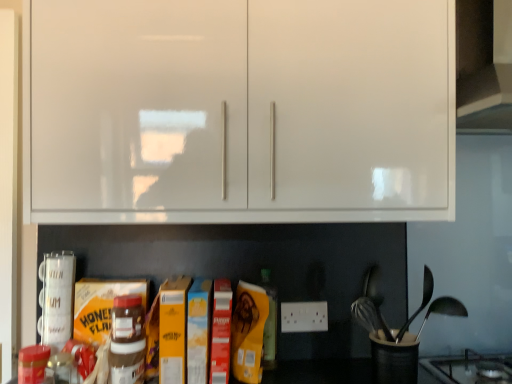
Where is `black plastic utensil holder at lower right`? The height and width of the screenshot is (384, 512). black plastic utensil holder at lower right is located at coordinates (394, 359).

The width and height of the screenshot is (512, 384). I want to click on matte brown plastic nutella jar at center, the second bottle positioned from the right, so click(127, 341).

In order to face satin silver spoon at right, should I rotate leftwards or rightwards?

Turn right approximately 21.248 degrees to face it.

The image size is (512, 384). What do you see at coordinates (421, 303) in the screenshot?
I see `satin silver spoon at right` at bounding box center [421, 303].

Measure the distance between matte brown bottle at center, which ranks as the first bottle in right-to-left order, and camera.

3.98 feet.

This screenshot has height=384, width=512. What do you see at coordinates (470, 369) in the screenshot?
I see `black glass gas stove at lower right` at bounding box center [470, 369].

I want to click on black plastic utensil holder at lower right, so coord(394,359).

From a real-world perspective, is matte brown plastic nutella jar at center, the first bottle in the front-to-back sequence, located beneath black glass gas stove at lower right?

Incorrect, from a real-world perspective, matte brown plastic nutella jar at center, the first bottle in the front-to-back sequence, is higher than black glass gas stove at lower right.

Can you tell me how much matte brown plastic nutella jar at center, marked as the second bottle in a back-to-front arrangement, and black glass gas stove at lower right differ in facing direction?

There is a 1.12-degree angle between the facing directions of matte brown plastic nutella jar at center, marked as the second bottle in a back-to-front arrangement, and black glass gas stove at lower right.

I want to click on the 2nd bottle to the left of the black glass gas stove at lower right, counting from the anchor's position, so click(127, 341).

Can you confirm if matte brown plastic nutella jar at center, the second bottle positioned from the right, is wider than black glass gas stove at lower right?

In fact, matte brown plastic nutella jar at center, the second bottle positioned from the right, might be narrower than black glass gas stove at lower right.

Can we say matte brown plastic nutella jar at center, the second bottle positioned from the right, lies outside white glossy cabinet at upper center?

Yes, matte brown plastic nutella jar at center, the second bottle positioned from the right, is outside of white glossy cabinet at upper center.

Identify the location of cabinetry located above the matte brown plastic nutella jar at center, the first bottle in the front-to-back sequence (from a real-world perspective). (241, 111).

From the image's perspective, relative to white glossy cabinet at upper center, is matte brown plastic nutella jar at center, the second bottle positioned from the right, above or below?

matte brown plastic nutella jar at center, the second bottle positioned from the right, is below white glossy cabinet at upper center.

Would you say white glossy cabinet at upper center is to the left or to the right of satin silver spoon at right in the picture?

white glossy cabinet at upper center is to the left of satin silver spoon at right.

Would you say white glossy cabinet at upper center is a long distance from satin silver spoon at right?

white glossy cabinet at upper center is near satin silver spoon at right, not far away.

From a real-world perspective, relative to satin silver spoon at right, is white glossy cabinet at upper center vertically above or below?

white glossy cabinet at upper center is above satin silver spoon at right.

How many degrees apart are the facing directions of white glossy cabinet at upper center and matte brown plastic nutella jar at center, acting as the 1th bottle starting from the left?

white glossy cabinet at upper center and matte brown plastic nutella jar at center, acting as the 1th bottle starting from the left, are facing 0.00157 degrees away from each other.

Is point (71, 145) positioned after point (127, 313)?

No, it is in front of (127, 313).

Is white glossy cabinet at upper center to the right of matte brown plastic nutella jar at center, the first bottle in the front-to-back sequence, from the viewer's perspective?

Correct, you'll find white glossy cabinet at upper center to the right of matte brown plastic nutella jar at center, the first bottle in the front-to-back sequence.

From a real-world perspective, between black glass gas stove at lower right and matte brown plastic nutella jar at center, acting as the 1th bottle starting from the left, who is vertically lower?

black glass gas stove at lower right is physically lower.

Could you tell me if black glass gas stove at lower right is facing matte brown plastic nutella jar at center, marked as the second bottle in a back-to-front arrangement?

No.

Is black glass gas stove at lower right at the right side of matte brown plastic nutella jar at center, acting as the 1th bottle starting from the left?

Indeed, black glass gas stove at lower right is positioned on the right side of matte brown plastic nutella jar at center, acting as the 1th bottle starting from the left.

Looking at this image, how many degrees apart are the facing directions of black glass gas stove at lower right and matte brown plastic nutella jar at center, acting as the 1th bottle starting from the left?

1.12 degrees.

Which of these two, matte brown bottle at center, which ranks as the second bottle in front-to-back order, or black plastic utensil holder at lower right, stands taller?

matte brown bottle at center, which ranks as the second bottle in front-to-back order, is taller.

Does matte brown bottle at center, placed as the second bottle when sorted from left to right, have a larger size compared to black plastic utensil holder at lower right?

No, matte brown bottle at center, placed as the second bottle when sorted from left to right, is not bigger than black plastic utensil holder at lower right.

Is the depth of matte brown bottle at center, which ranks as the first bottle in right-to-left order, less than that of black plastic utensil holder at lower right?

No, it is behind black plastic utensil holder at lower right.

From the image's perspective, is matte brown plastic nutella jar at center, the first bottle in the front-to-back sequence, over black plastic utensil holder at lower right?

Indeed, from the image's perspective, matte brown plastic nutella jar at center, the first bottle in the front-to-back sequence, is shown above black plastic utensil holder at lower right.

Is matte brown plastic nutella jar at center, marked as the second bottle in a back-to-front arrangement, in contact with black plastic utensil holder at lower right?

No, matte brown plastic nutella jar at center, marked as the second bottle in a back-to-front arrangement, is not with black plastic utensil holder at lower right.

The image size is (512, 384). What are the coordinates of `appliance to the right of matte brown plastic nutella jar at center, acting as the 1th bottle starting from the left` in the screenshot? It's located at (394, 359).

Considering the relative sizes of matte brown plastic nutella jar at center, the first bottle in the front-to-back sequence, and black plastic utensil holder at lower right in the image provided, is matte brown plastic nutella jar at center, the first bottle in the front-to-back sequence, bigger than black plastic utensil holder at lower right?

No, matte brown plastic nutella jar at center, the first bottle in the front-to-back sequence, is not bigger than black plastic utensil holder at lower right.

Starting from the black glass gas stove at lower right, which bottle is the 2nd one to the left? Please provide its 2D coordinates.

[(127, 341)]

The width and height of the screenshot is (512, 384). I want to click on cabinetry above the matte brown plastic nutella jar at center, the second bottle positioned from the right (from the image's perspective), so click(x=241, y=111).

Looking at the image, which one is located further to black glass gas stove at lower right, black plastic utensil holder at lower right or matte brown bottle at center, arranged as the 1th bottle when viewed from the back?

matte brown bottle at center, arranged as the 1th bottle when viewed from the back, is positioned further to the anchor black glass gas stove at lower right.

Looking at the image, which one is located closer to satin silver spoon at right, black glass gas stove at lower right or black plastic utensil holder at lower right?

black glass gas stove at lower right is positioned closer to the anchor satin silver spoon at right.

When comparing their distances from white glossy cabinet at upper center, does satin silver spoon at right or black glass gas stove at lower right seem closer?

satin silver spoon at right is closer to white glossy cabinet at upper center.

Which object lies nearer to the anchor point matte brown plastic nutella jar at center, the first bottle in the front-to-back sequence, satin silver spoon at right or white glossy cabinet at upper center?

white glossy cabinet at upper center.

Which object lies nearer to the anchor point black plastic utensil holder at lower right, satin silver spoon at right or matte brown bottle at center, placed as the second bottle when sorted from left to right?

satin silver spoon at right is closer to black plastic utensil holder at lower right.

Which object lies further to the anchor point white glossy cabinet at upper center, matte brown plastic nutella jar at center, the first bottle in the front-to-back sequence, or black glass gas stove at lower right?

Based on the image, black glass gas stove at lower right appears to be further to white glossy cabinet at upper center.

Looking at the image, which one is located further to matte brown plastic nutella jar at center, the second bottle positioned from the right, black plastic utensil holder at lower right or matte brown bottle at center, arranged as the 1th bottle when viewed from the back?

black plastic utensil holder at lower right is positioned further to the anchor matte brown plastic nutella jar at center, the second bottle positioned from the right.

Based on their spatial positions, is matte brown plastic nutella jar at center, acting as the 1th bottle starting from the left, or white glossy cabinet at upper center closer to satin silver spoon at right?

Among the two, white glossy cabinet at upper center is located nearer to satin silver spoon at right.

Where is `silverware between white glossy cabinet at upper center and matte brown bottle at center, which ranks as the second bottle in front-to-back order, from top to bottom`? This screenshot has width=512, height=384. silverware between white glossy cabinet at upper center and matte brown bottle at center, which ranks as the second bottle in front-to-back order, from top to bottom is located at coordinates (421, 303).

In order to click on silverware between white glossy cabinet at upper center and black plastic utensil holder at lower right from top to bottom in this screenshot , I will do `click(421, 303)`.

The height and width of the screenshot is (384, 512). In order to click on silverware between black plastic utensil holder at lower right and black glass gas stove at lower right from left to right in this screenshot , I will do `click(421, 303)`.

Locate an element on the screen. Image resolution: width=512 pixels, height=384 pixels. appliance situated between matte brown bottle at center, arranged as the 1th bottle when viewed from the back, and black glass gas stove at lower right from left to right is located at coordinates (394, 359).